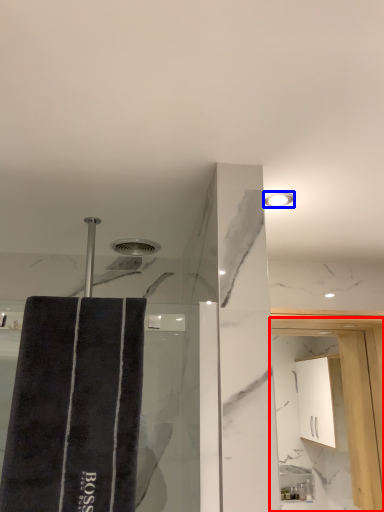
Question: Which point is closer to the camera, screen door (highlighted by a red box) or light fixture (highlighted by a blue box)?

Choices:
 (A) screen door
 (B) light fixture

Answer: (B)